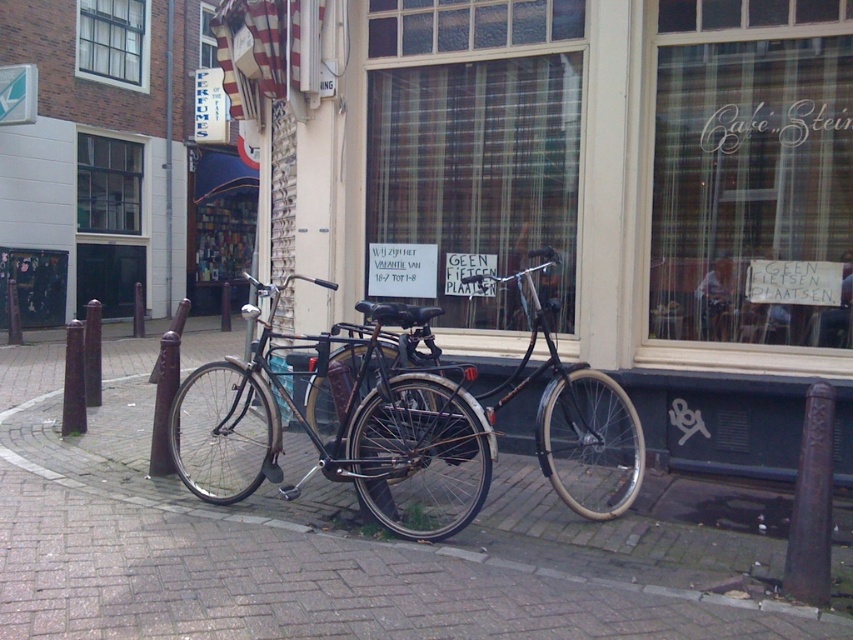
Does brick pavement at center have a lesser height compared to plaid fabric shop window at center?

Correct, brick pavement at center is not as tall as plaid fabric shop window at center.

Who is taller, brick pavement at center or plaid fabric shop window at center?

With more height is plaid fabric shop window at center.

Is point (532, 532) in front of point (509, 13)?

Yes, point (532, 532) is closer to viewer.

I want to click on brick pavement at center, so click(x=335, y=547).

Between clear glass window at upper right and shiny metallic bicycle at center, which one appears on the left side from the viewer's perspective?

From the viewer's perspective, shiny metallic bicycle at center appears more on the left side.

Which is behind, point (664, 212) or point (181, 404)?

Positioned behind is point (181, 404).

Locate an element on the screen. The image size is (853, 640). clear glass window at upper right is located at coordinates (752, 173).

Between shiny metallic bicycle at center and shiny black bicycle at center, which one is positioned lower?

shiny metallic bicycle at center is lower down.

Does shiny metallic bicycle at center have a lesser width compared to shiny black bicycle at center?

Correct, shiny metallic bicycle at center's width is less than shiny black bicycle at center's.

Between point (454, 435) and point (602, 476), which one is positioned behind?

Positioned behind is point (602, 476).

Identify the location of shiny metallic bicycle at center. (338, 420).